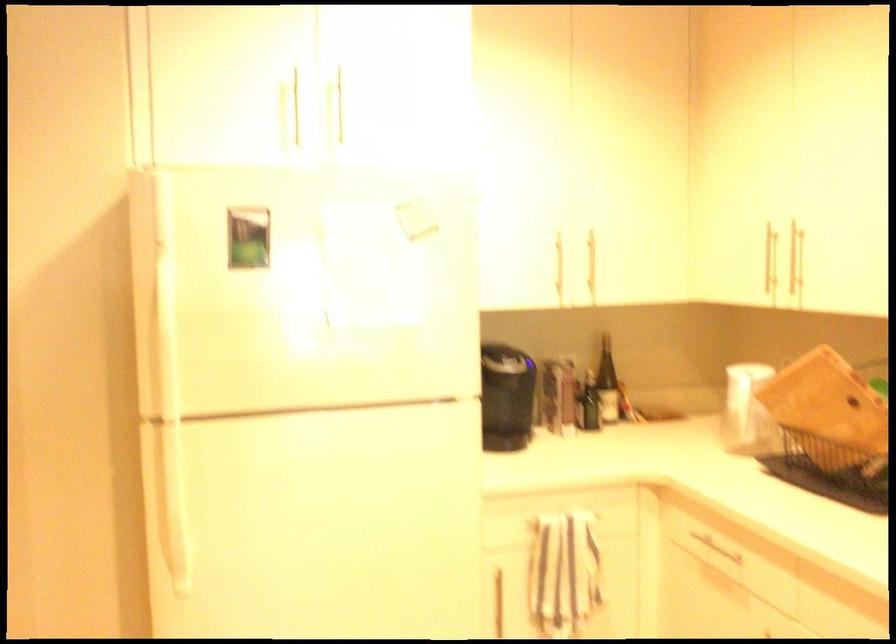
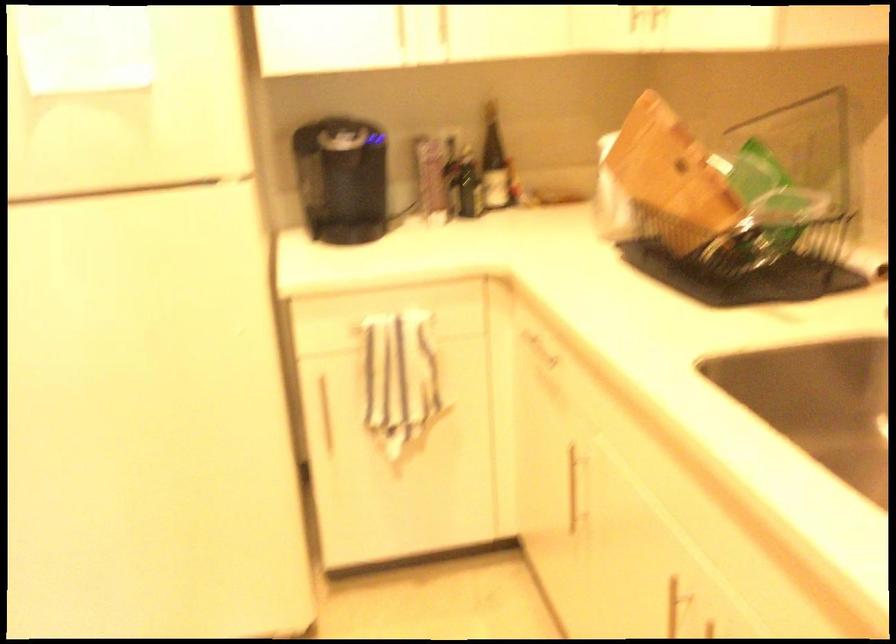
Question: How did the camera likely rotate?

Choices:
 (A) Left
 (B) Right
 (C) Up
 (D) Down

Answer: (D)